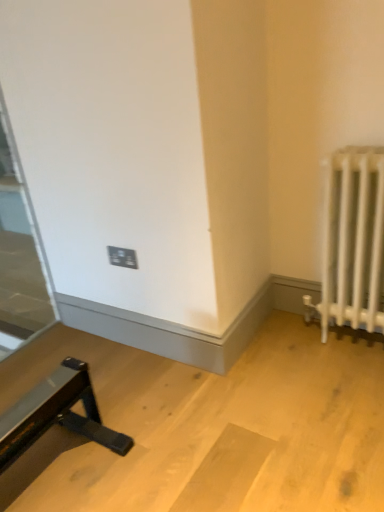
Image resolution: width=384 pixels, height=512 pixels. What are the coordinates of `vacant space situated on the left part of white metal radiator at right` in the screenshot? It's located at (297, 342).